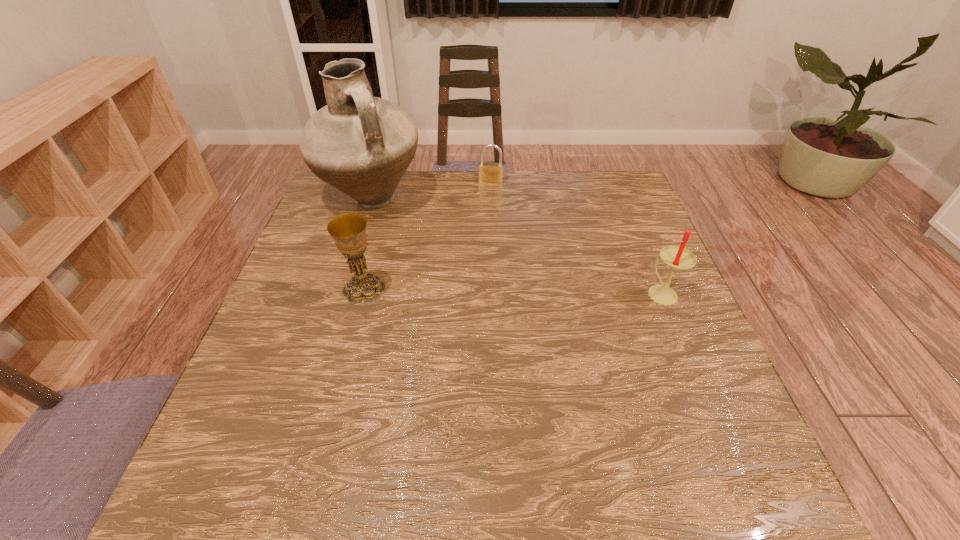
Find the location of a particular element. This screenshot has height=540, width=960. free spot between the chalice and the candle is located at coordinates (513, 291).

Locate an element on the screen. free spot between the rightmost object and the chalice is located at coordinates (513, 291).

The image size is (960, 540). What are the coordinates of `vacant region between the pitcher and the padlock` in the screenshot? It's located at (431, 192).

Find the location of `vacant region between the candle and the padlock`. vacant region between the candle and the padlock is located at coordinates (576, 238).

The width and height of the screenshot is (960, 540). Find the location of `vacant space in between the candle and the pitcher`. vacant space in between the candle and the pitcher is located at coordinates (516, 247).

This screenshot has height=540, width=960. What are the coordinates of `object that ranks as the third closest to the tallest object` in the screenshot? It's located at (677, 257).

At what (x,y) coordinates should I click in order to perform the action: click on the third closest object to the tallest object. Please return your answer as a coordinate pair (x, y). Looking at the image, I should click on (677, 257).